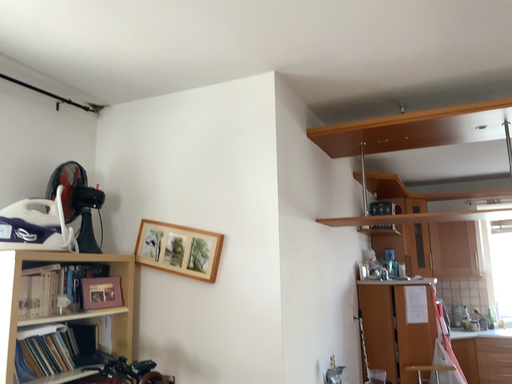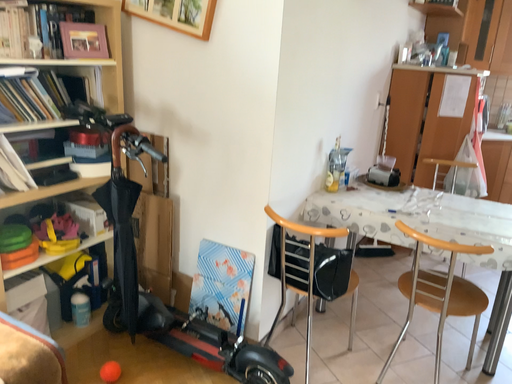
Question: How did the camera likely rotate when shooting the video?

Choices:
 (A) rotated downward
 (B) rotated upward

Answer: (A)